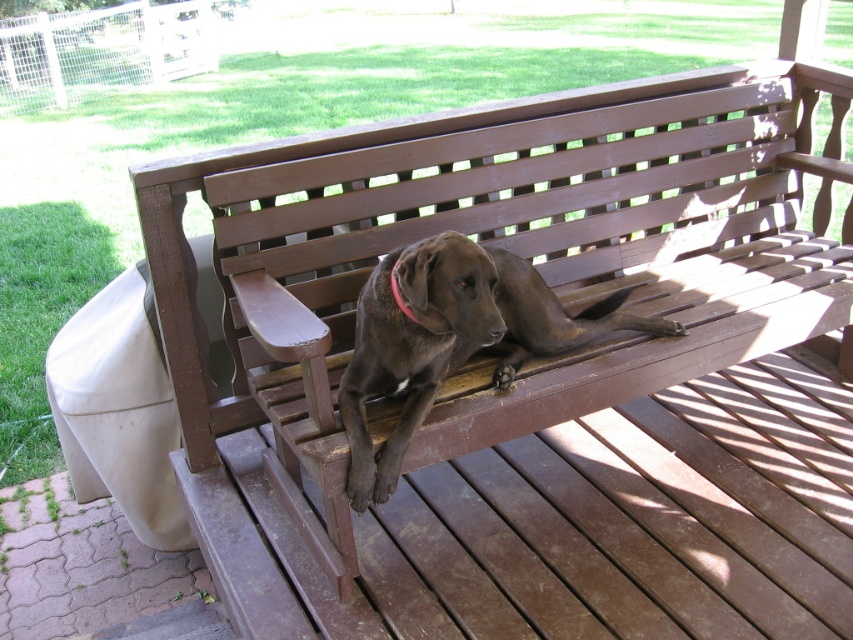
Does brown matte dog at center appear under pink fabric neckband at center?

Yes, brown matte dog at center is below pink fabric neckband at center.

What do you see at coordinates (451, 339) in the screenshot? The image size is (853, 640). I see `brown matte dog at center` at bounding box center [451, 339].

Who is more forward, (619,328) or (397,262)?

Point (397,262) is in front.

In order to click on brown matte dog at center in this screenshot , I will do `click(451, 339)`.

Which is behind, point (729, 252) or point (465, 257)?

The point (729, 252) is behind.

Is point (221, 148) positioned before point (474, 266)?

No, it is not.

Identify the location of brown wooden bench at center. The width and height of the screenshot is (853, 640). (514, 250).

The image size is (853, 640). Find the location of `brown wooden bench at center`. brown wooden bench at center is located at coordinates (514, 250).

Describe the element at coordinates (514, 250) in the screenshot. I see `brown wooden bench at center` at that location.

Find the location of a particular element. This screenshot has width=853, height=640. brown wooden bench at center is located at coordinates (514, 250).